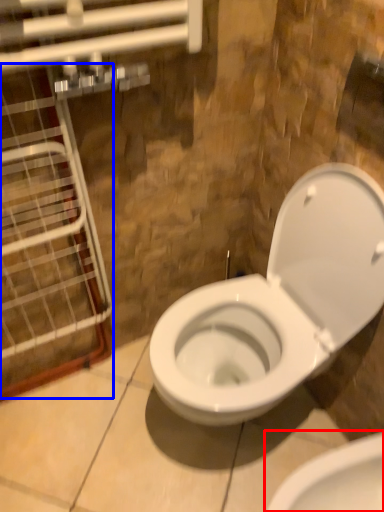
Question: Which point is closer to the camera, toilet (highlighted by a red box) or glass door (highlighted by a blue box)?

Choices:
 (A) toilet
 (B) glass door

Answer: (B)